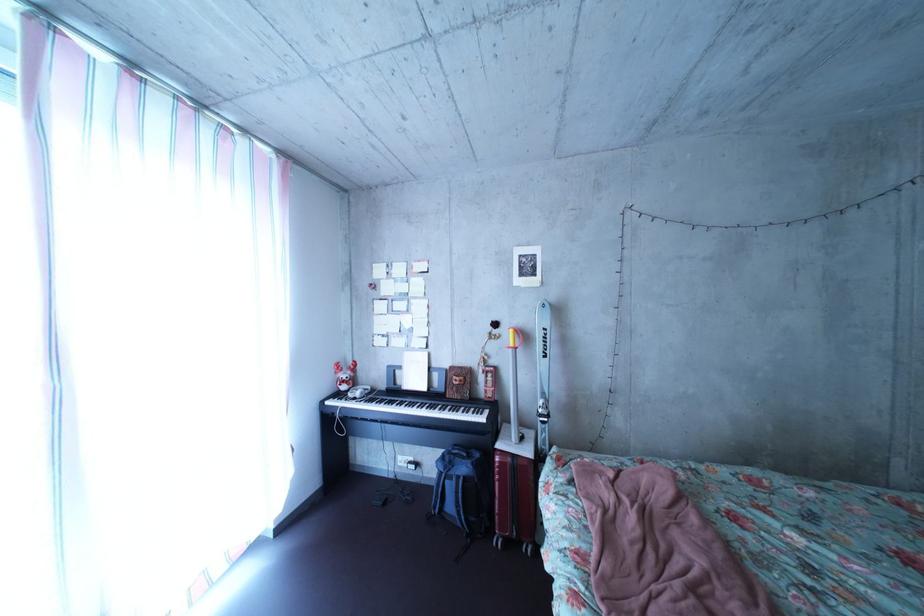
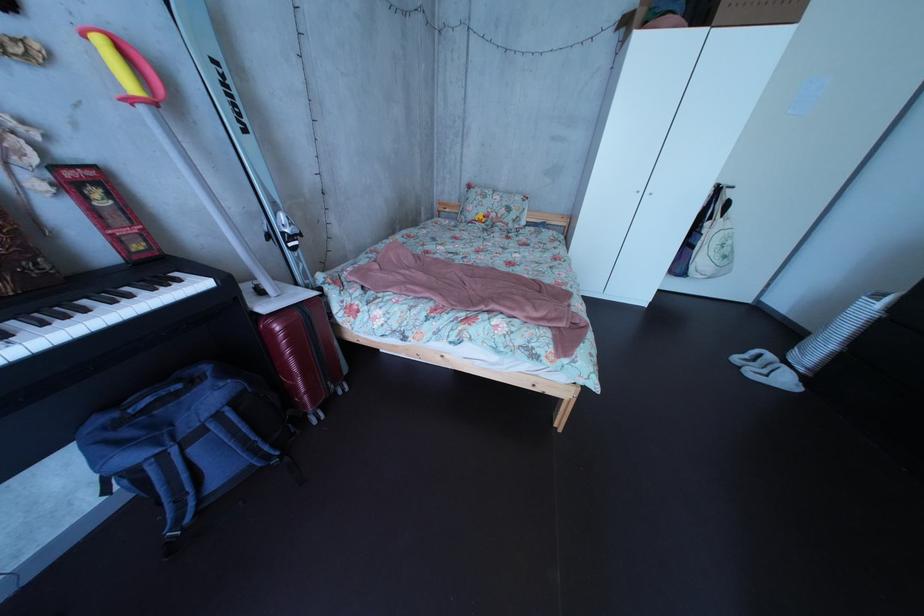
Find the pixel in the second image that matches (524,468) in the first image.

(311, 322)